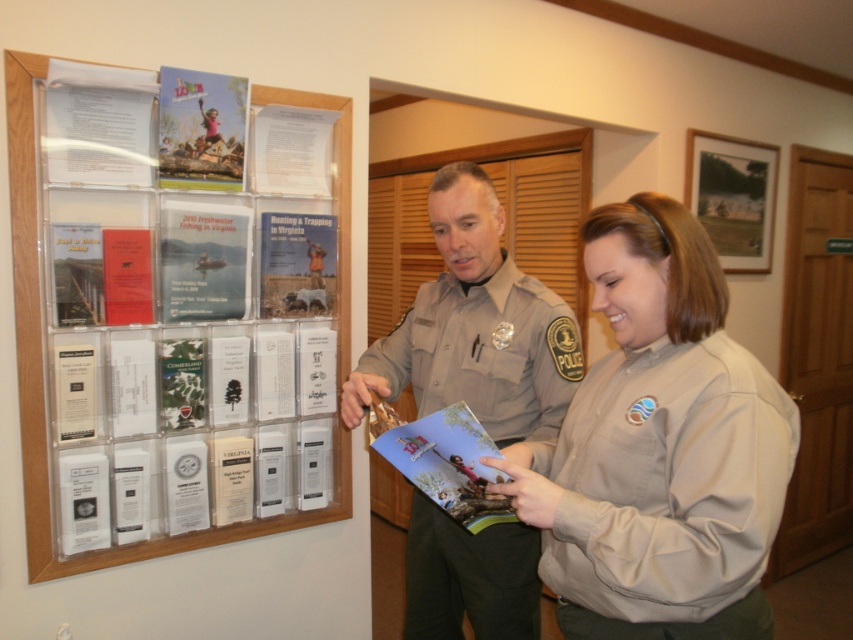
Question: Among these objects, which one is nearest to the camera?

Choices:
 (A) matte paper poster at center
 (B) matte plastic brochure at upper left
 (C) tan uniform at center
 (D) beige uniform at center

Answer: (D)

Question: Among these points, which one is farthest from the camera?

Choices:
 (A) (585, 609)
 (B) (426, 529)
 (C) (109, 518)

Answer: (C)

Question: Among these objects, which one is nearest to the camera?

Choices:
 (A) beige uniform at center
 (B) matte paper poster at center

Answer: (A)

Question: Does matte plastic brochure at upper left have a larger size compared to matte paper poster at center?

Choices:
 (A) yes
 (B) no

Answer: (A)

Question: Is tan uniform at center wider than matte paper poster at center?

Choices:
 (A) no
 (B) yes

Answer: (B)

Question: Is matte plastic brochure at upper left in front of matte paper poster at center?

Choices:
 (A) yes
 (B) no

Answer: (A)